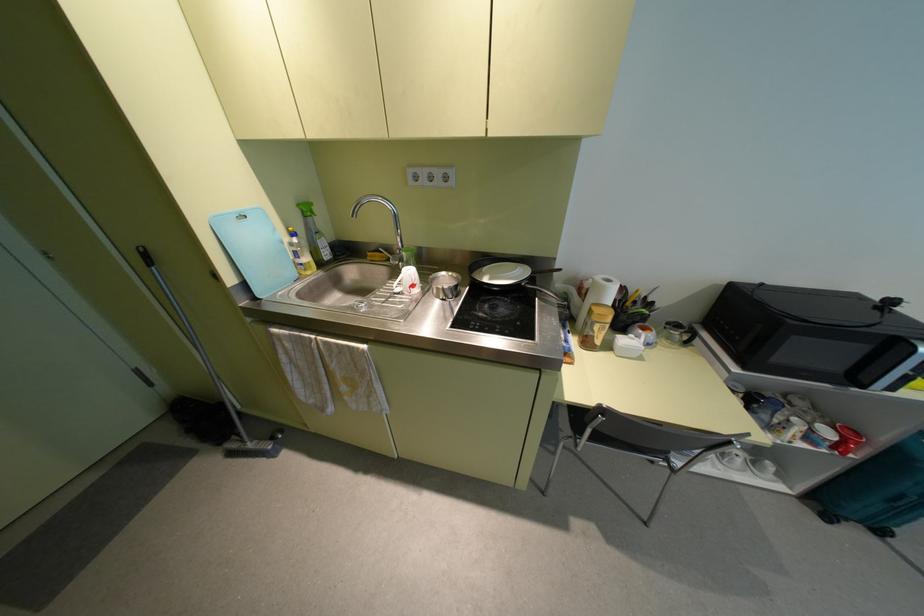
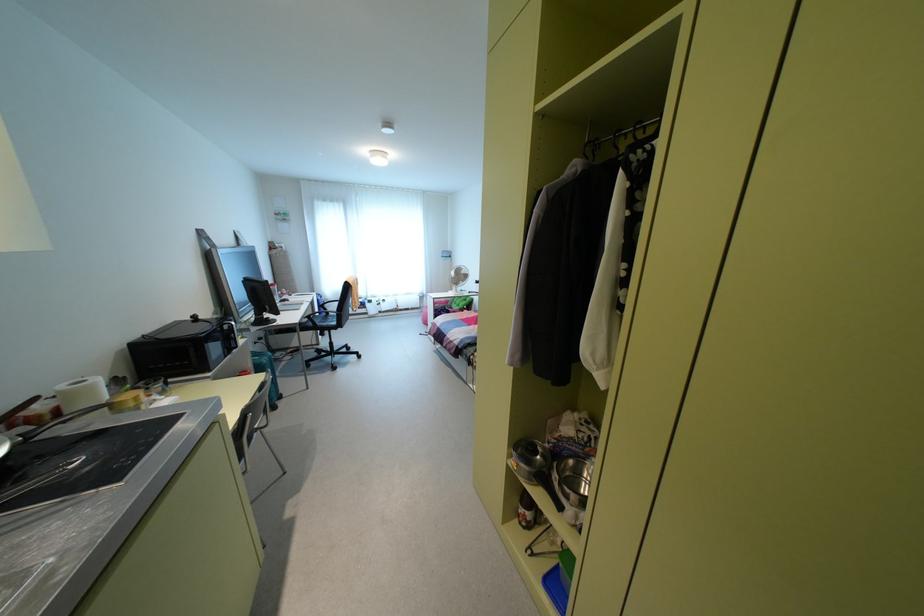
Locate, in the second image, the point that corresponds to (599,277) in the first image.

(62, 387)